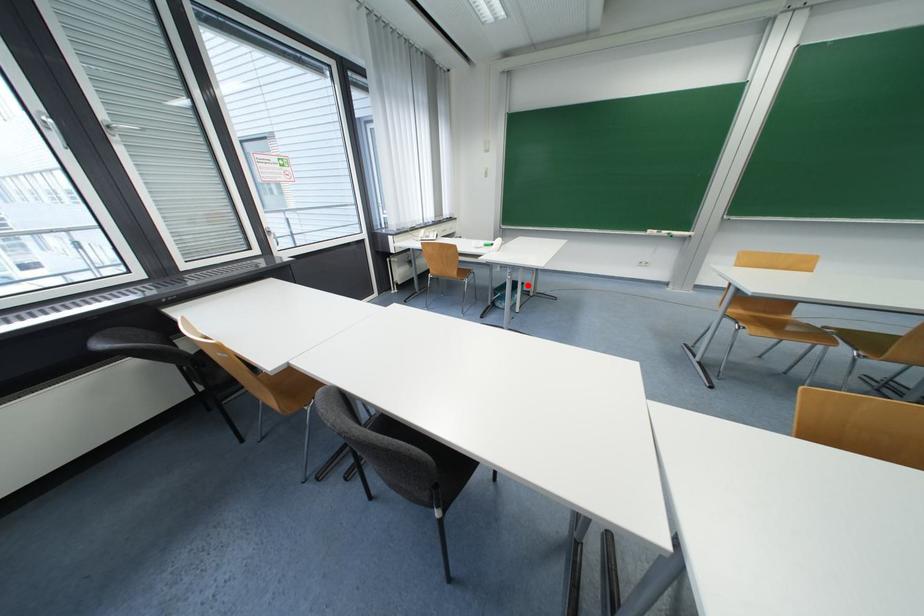
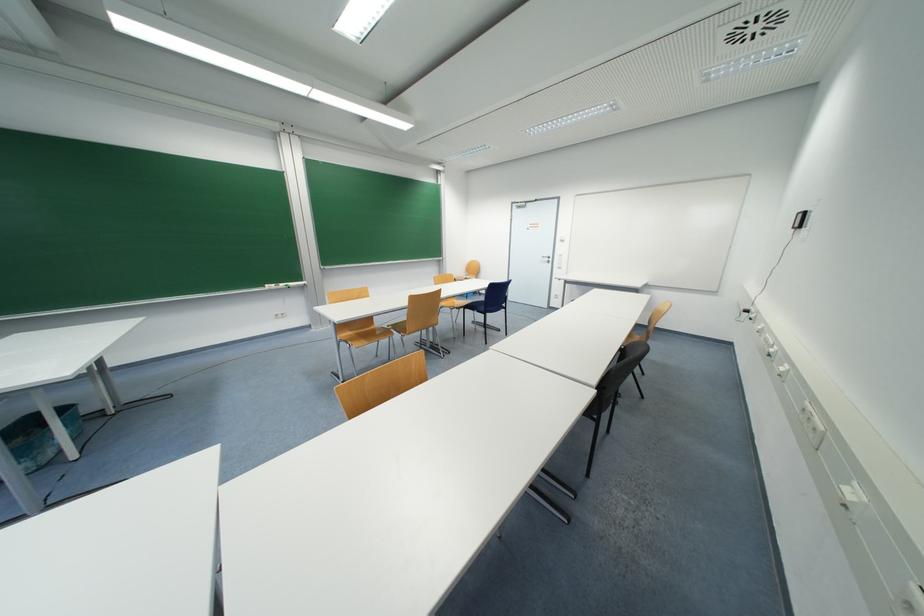
Question: I am providing you with two images of the same scene from different viewpoints. A red point is shown in image1. For the corresponding object point in image2, is it positioned nearer or farther from the camera?

Choices:
 (A) Nearer
 (B) Farther

Answer: (A)